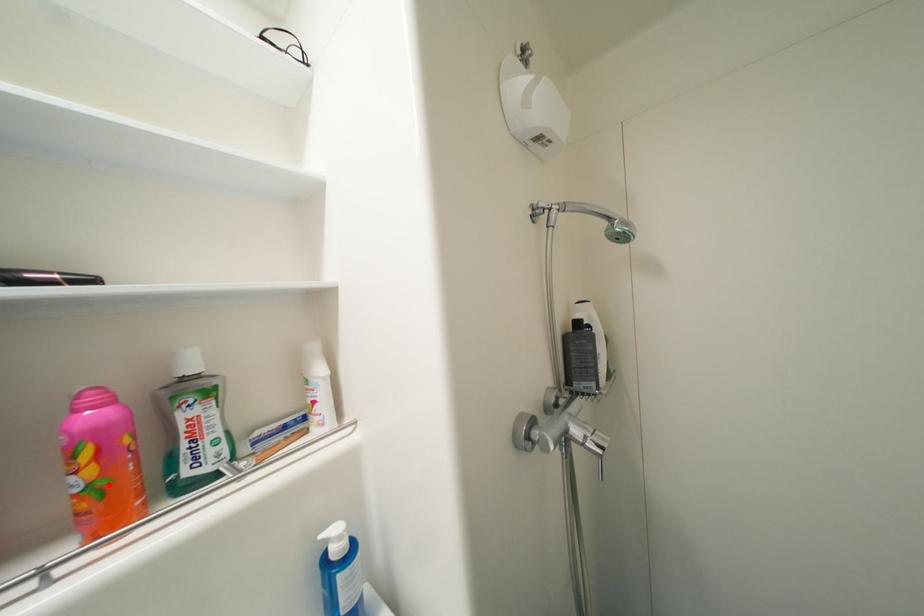
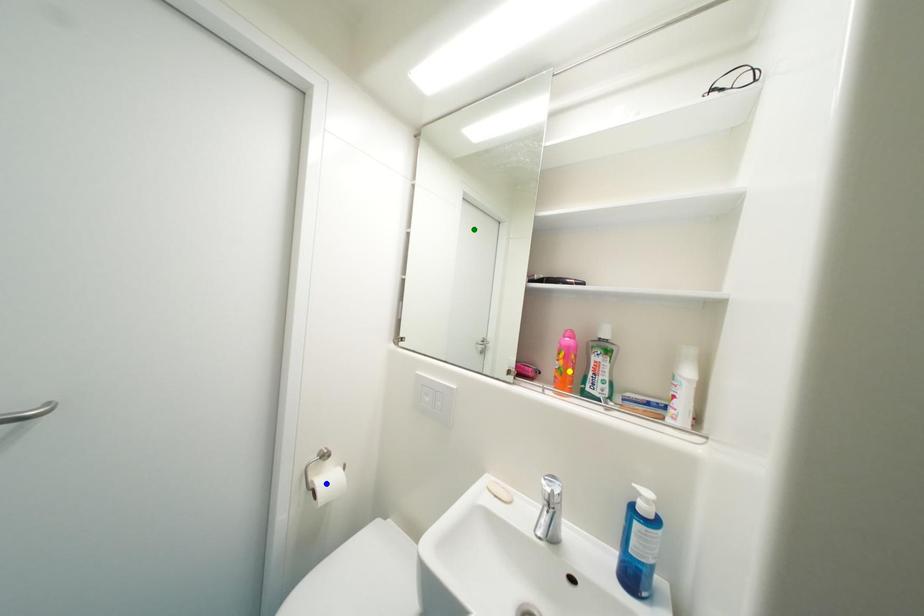
Question: I am providing you with two images of the same scene from different viewpoints. A red point is marked on the first image. You are given multiple points on the second image. In image 2, which mark is for the same physical point as the one in image 1?

Choices:
 (A) green point
 (B) yellow point
 (C) blue point

Answer: (B)